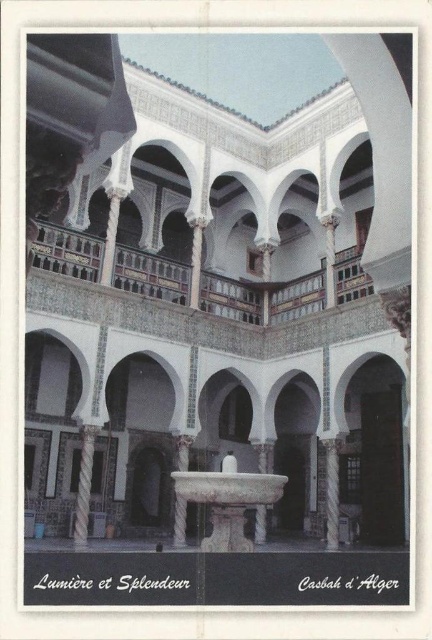
Is the position of white marble fountain at center more distant than that of white marble pillar at left?

No, it is not.

Does white marble fountain at center appear under white marble pillar at left?

Yes.

Describe the element at coordinates (225, 502) in the screenshot. I see `white marble fountain at center` at that location.

Find the location of a particular element. white marble fountain at center is located at coordinates (225, 502).

Is white marble pillar at left smaller than white marble pillar at center?

No.

Does point (82, 456) come farther from viewer compared to point (333, 516)?

No, (82, 456) is closer to viewer.

The image size is (432, 640). Find the location of `white marble pillar at left`. white marble pillar at left is located at coordinates (83, 484).

Is white marble fountain at center smaller than white marble pillar at center?

No.

The width and height of the screenshot is (432, 640). Find the location of `white marble fountain at center`. white marble fountain at center is located at coordinates (225, 502).

You are a GUI agent. You are given a task and a screenshot of the screen. Output one action in this format:
    pyautogui.click(x=<x>, y=<y>)
    Task: Click on the white marble fountain at center
    
    Given the screenshot: What is the action you would take?
    pyautogui.click(x=225, y=502)